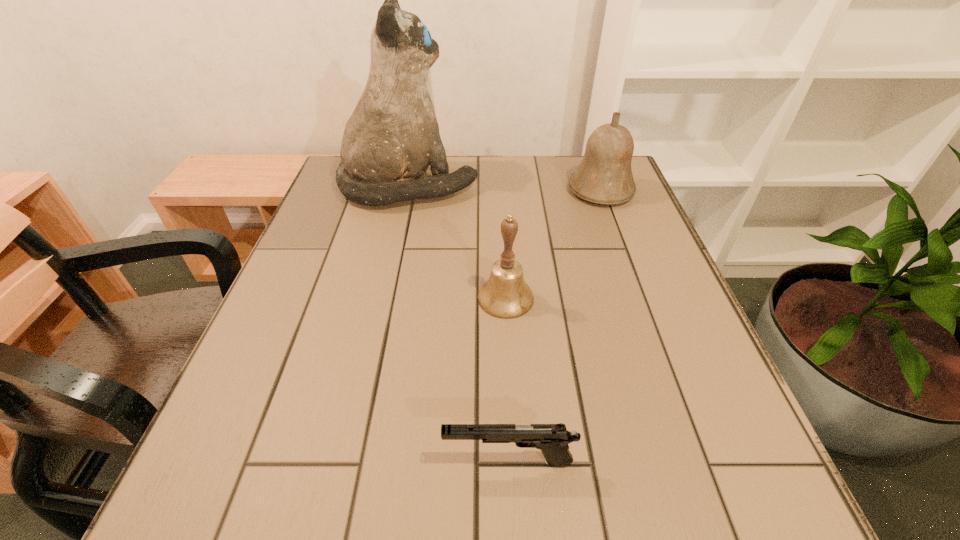
Find the location of a particular element. empty location between the rightmost object and the cat is located at coordinates (505, 188).

Where is `free space that is in between the third farthest object and the shortest object`? free space that is in between the third farthest object and the shortest object is located at coordinates (507, 379).

The image size is (960, 540). What are the coordinates of `unoccupied position between the second nearest object and the nearest object` in the screenshot? It's located at (507, 379).

You are a GUI agent. You are given a task and a screenshot of the screen. Output one action in this format:
    pyautogui.click(x=<x>, y=<y>)
    Task: Click on the vacant area that lies between the cat and the left bell
    The image size is (960, 540).
    Given the screenshot: What is the action you would take?
    pyautogui.click(x=458, y=241)

Identify the location of free space that is in between the rightmost object and the cat. The height and width of the screenshot is (540, 960). [x=505, y=188].

The height and width of the screenshot is (540, 960). In order to click on the third closest object to the nearer bell in this screenshot , I will do `click(604, 176)`.

You are a GUI agent. You are given a task and a screenshot of the screen. Output one action in this format:
    pyautogui.click(x=<x>, y=<y>)
    Task: Click on the closest object to the gun
    The width and height of the screenshot is (960, 540).
    Given the screenshot: What is the action you would take?
    pyautogui.click(x=505, y=295)

The width and height of the screenshot is (960, 540). In order to click on free region that satisfies the following two spatial constraints: 1. at the face of the cat; 2. on the right side of the second nearest object in this screenshot , I will do `click(385, 298)`.

Where is `vacant space that satisfies the following two spatial constraints: 1. on the back side of the rightmost object; 2. on the right side of the second nearest object`? The height and width of the screenshot is (540, 960). vacant space that satisfies the following two spatial constraints: 1. on the back side of the rightmost object; 2. on the right side of the second nearest object is located at coordinates (499, 190).

Image resolution: width=960 pixels, height=540 pixels. Identify the location of vacant space that satisfies the following two spatial constraints: 1. on the front side of the farther bell; 2. at the aiming end of the shortest object. (701, 461).